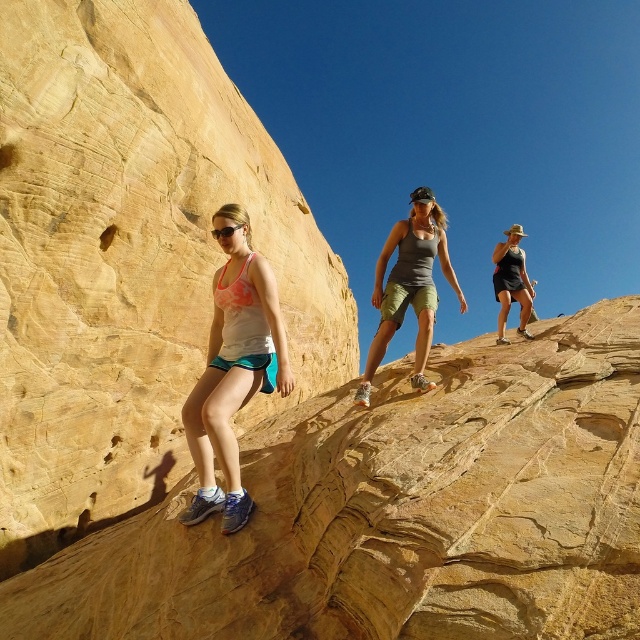
Between point (237, 504) and point (424, 253), which one is positioned in front?

Positioned in front is point (237, 504).

Who is positioned more to the right, white matte tank top at center or gray fabric tank top at center?

gray fabric tank top at center

Which is behind, point (232, 401) or point (432, 300)?

Positioned behind is point (432, 300).

Locate an element on the screen. Image resolution: width=640 pixels, height=640 pixels. white matte tank top at center is located at coordinates (234, 369).

Measure the distance between point [435,227] and camera.

Point [435,227] is 44.45 meters away from camera.

Between gray fabric tank top at center and matte black tank top at upper right, which one is positioned higher?

matte black tank top at upper right

What do you see at coordinates (410, 285) in the screenshot?
I see `gray fabric tank top at center` at bounding box center [410, 285].

The width and height of the screenshot is (640, 640). Identify the location of gray fabric tank top at center. (410, 285).

Who is shorter, yellow sandstone rock face at left or gray fabric tank top at center?

gray fabric tank top at center

Does yellow sandstone rock face at left have a lesser width compared to gray fabric tank top at center?

No.

Identify the location of yellow sandstone rock face at left. (129, 259).